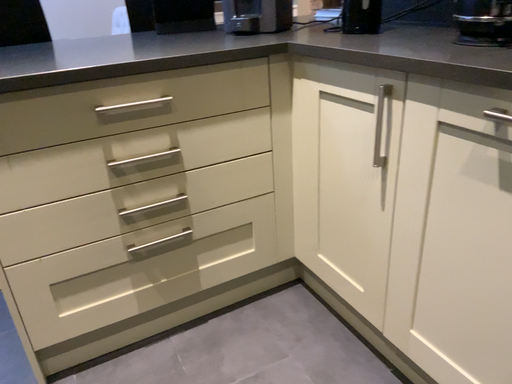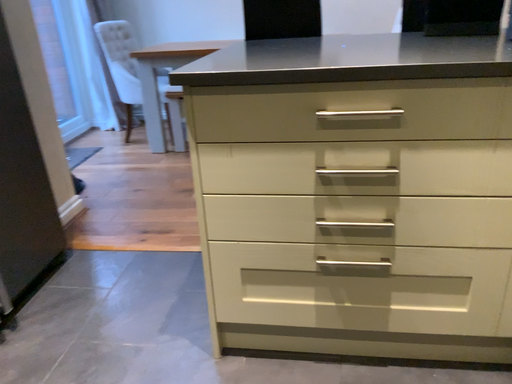
Question: Which way did the camera rotate in the video?

Choices:
 (A) rotated right
 (B) rotated left

Answer: (B)